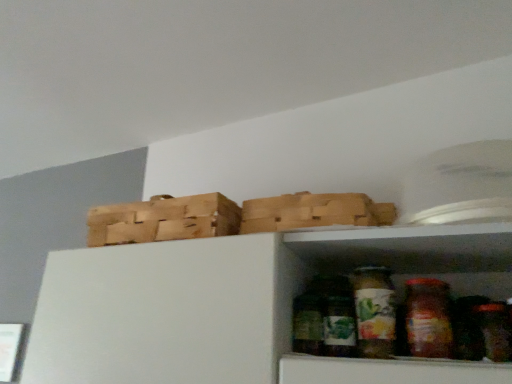
Question: Does green matte glass jar at lower center, positioned as the 1th glass jar in left-to-right order, come behind wooden crate at upper left?

Choices:
 (A) no
 (B) yes

Answer: (A)

Question: Is green matte glass jar at lower center, positioned as the 1th glass jar in left-to-right order, smaller than wooden crate at upper left?

Choices:
 (A) no
 (B) yes

Answer: (B)

Question: From the image's perspective, would you say green matte glass jar at lower center, the second glass jar in the right-to-left sequence, is positioned over wooden crate at upper left?

Choices:
 (A) yes
 (B) no

Answer: (B)

Question: Is green matte glass jar at lower center, the second glass jar in the right-to-left sequence, oriented towards wooden crate at upper left?

Choices:
 (A) no
 (B) yes

Answer: (A)

Question: Is green matte glass jar at lower center, positioned as the 1th glass jar in left-to-right order, wider than wooden crate at upper left?

Choices:
 (A) no
 (B) yes

Answer: (A)

Question: Is green matte glass jar at lower center, the second glass jar in the right-to-left sequence, to the left or to the right of wooden crate at upper left in the image?

Choices:
 (A) right
 (B) left

Answer: (A)

Question: Is green matte glass jar at lower center, the second glass jar in the right-to-left sequence, wider or thinner than wooden crate at upper left?

Choices:
 (A) wide
 (B) thin

Answer: (B)

Question: Is point (387, 294) positioned closer to the camera than point (185, 225)?

Choices:
 (A) closer
 (B) farther

Answer: (A)

Question: Is green matte glass jar at lower center, the second glass jar in the right-to-left sequence, spatially inside wooden crate at upper left, or outside of it?

Choices:
 (A) inside
 (B) outside

Answer: (B)

Question: From the image's perspective, relative to green matte glass jar at lower center, the second glass jar in the right-to-left sequence, is wooden crate at upper left above or below?

Choices:
 (A) above
 (B) below

Answer: (A)

Question: Choose the correct answer: Is wooden crate at upper left inside green matte glass jar at lower center, the second glass jar in the right-to-left sequence, or outside it?

Choices:
 (A) inside
 (B) outside

Answer: (B)

Question: From a real-world perspective, relative to green matte glass jar at lower center, the second glass jar in the right-to-left sequence, is wooden crate at upper left vertically above or below?

Choices:
 (A) above
 (B) below

Answer: (A)

Question: In terms of height, does wooden crate at upper left look taller or shorter compared to green matte glass jar at lower center, positioned as the 1th glass jar in left-to-right order?

Choices:
 (A) short
 (B) tall

Answer: (A)

Question: From a real-world perspective, is wooden crate at upper left physically located above or below translucent glass jar at center, which ranks as the first glass jar in right-to-left order?

Choices:
 (A) above
 (B) below

Answer: (A)

Question: From the image's perspective, relative to translucent glass jar at center, positioned as the 2th glass jar in left-to-right order, is wooden crate at upper left above or below?

Choices:
 (A) above
 (B) below

Answer: (A)